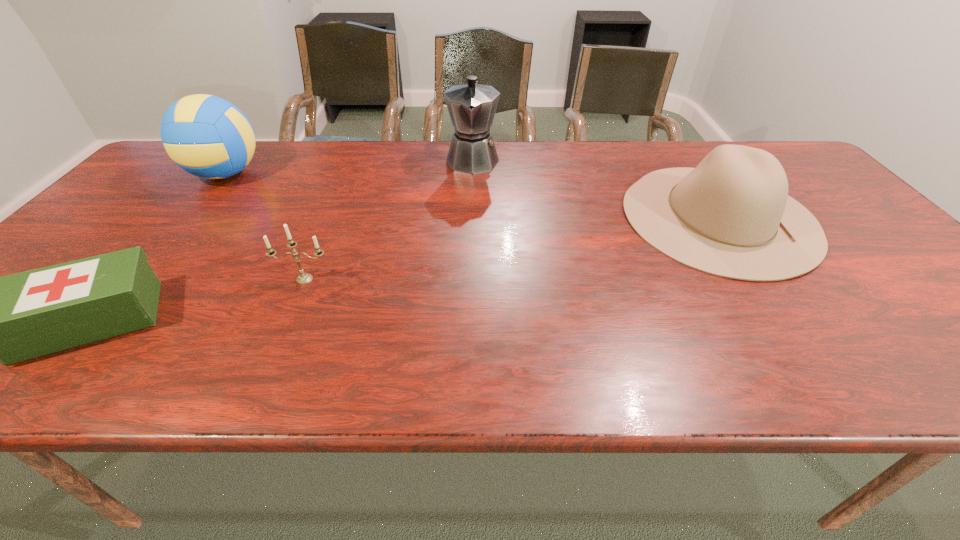
Locate an element on the screen. This screenshot has width=960, height=540. vacant space in between the candle and the sombrero is located at coordinates (512, 248).

Where is `vacant space in between the volleyball and the third tallest object`? The height and width of the screenshot is (540, 960). vacant space in between the volleyball and the third tallest object is located at coordinates (472, 195).

Where is `vacant area that lies between the fourth object from left to right and the rightmost object`? The height and width of the screenshot is (540, 960). vacant area that lies between the fourth object from left to right and the rightmost object is located at coordinates (595, 188).

Find the location of a particular element. free space between the volleyball and the third tallest object is located at coordinates (472, 195).

You are a GUI agent. You are given a task and a screenshot of the screen. Output one action in this format:
    pyautogui.click(x=<x>, y=<y>)
    Task: Click on the object that is the fourth nearest to the shortest object
    
    Given the screenshot: What is the action you would take?
    pyautogui.click(x=731, y=216)

The image size is (960, 540). I want to click on object identified as the fourth closest to the shortest object, so click(731, 216).

The image size is (960, 540). What are the coordinates of `free space that satisfies the following two spatial constraints: 1. at the spout of the sombrero; 2. on the left side of the second object from right to left` in the screenshot? It's located at (471, 217).